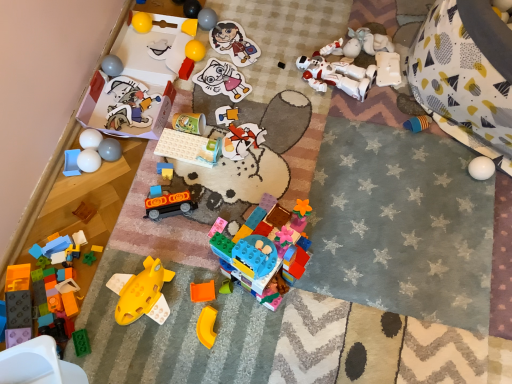
At what (x,y) coordinates should I click in order to perform the action: click on space that is in front of black plastic train at center, which is counted as the tenth toy, starting from the left. Please return your answer as a coordinate pair (x, y). The height and width of the screenshot is (384, 512). Looking at the image, I should click on (170, 259).